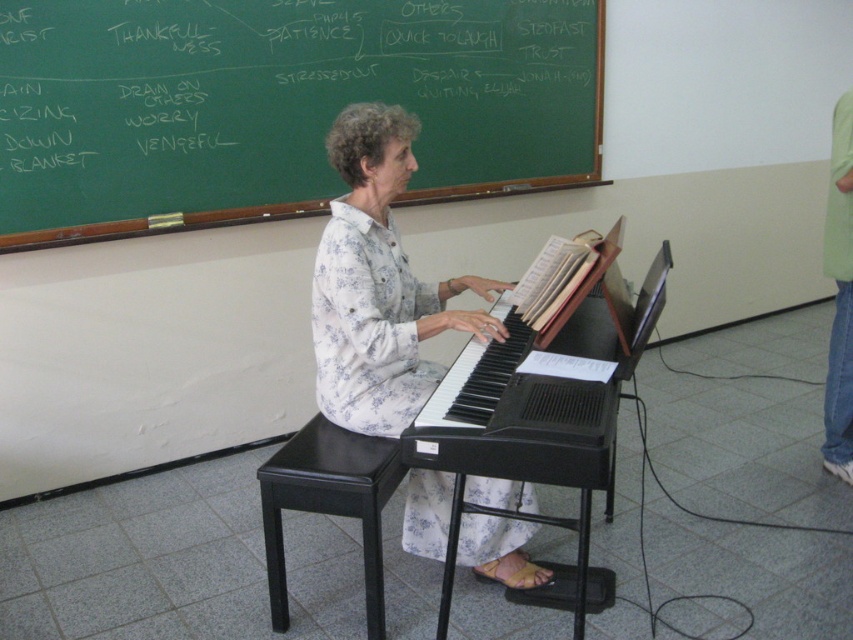
Question: Which of the following is the closest to the observer?

Choices:
 (A) (410, 490)
 (B) (393, 481)

Answer: (B)

Question: Based on their relative distances, which object is farther from the white floral shirt at center?

Choices:
 (A) black leather stool at lower center
 (B) green chalkboard at upper center

Answer: (B)

Question: Is green chalkboard at upper center below white floral shirt at center?

Choices:
 (A) no
 (B) yes

Answer: (A)

Question: Which point is farther to the camera?

Choices:
 (A) white floral shirt at center
 (B) green chalkboard at upper center
 (C) black leather stool at lower center

Answer: (B)

Question: Can you confirm if white floral shirt at center is bigger than black leather stool at lower center?

Choices:
 (A) no
 (B) yes

Answer: (B)

Question: Is green chalkboard at upper center thinner than white floral shirt at center?

Choices:
 (A) no
 (B) yes

Answer: (A)